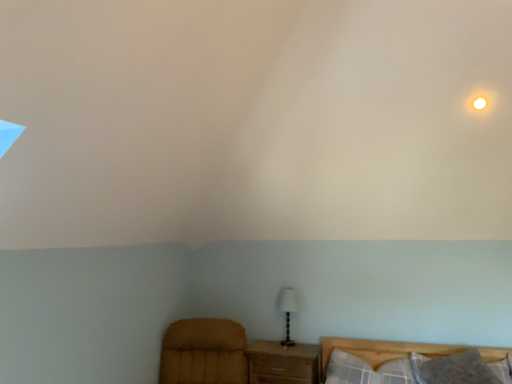
Question: From the image's perspective, is white fabric lampshade at center above or below plaid fabric pillow at lower right, the 1th pillow positioned from the left?

Choices:
 (A) above
 (B) below

Answer: (A)

Question: Is white fabric lampshade at center inside the boundaries of plaid fabric pillow at lower right, the 1th pillow positioned from the left, or outside?

Choices:
 (A) inside
 (B) outside

Answer: (B)

Question: Estimate the real-world distances between objects in this image. Which object is closer to the white fabric lampshade at center?

Choices:
 (A) velvet brown armchair at lower left
 (B) white glossy light at upper right
 (C) gray soft pillow at lower right, the first pillow when ordered from right to left
 (D) plaid fabric pillow at lower right, the second pillow when ordered from right to left
 (E) wooden nightstand at lower center

Answer: (E)

Question: Which of these objects is positioned closest to the white glossy light at upper right?

Choices:
 (A) white fabric lampshade at center
 (B) gray soft pillow at lower right, the 2th pillow when ordered from left to right
 (C) velvet brown armchair at lower left
 (D) wooden nightstand at lower center
 (E) plaid fabric pillow at lower right, the second pillow when ordered from right to left

Answer: (B)